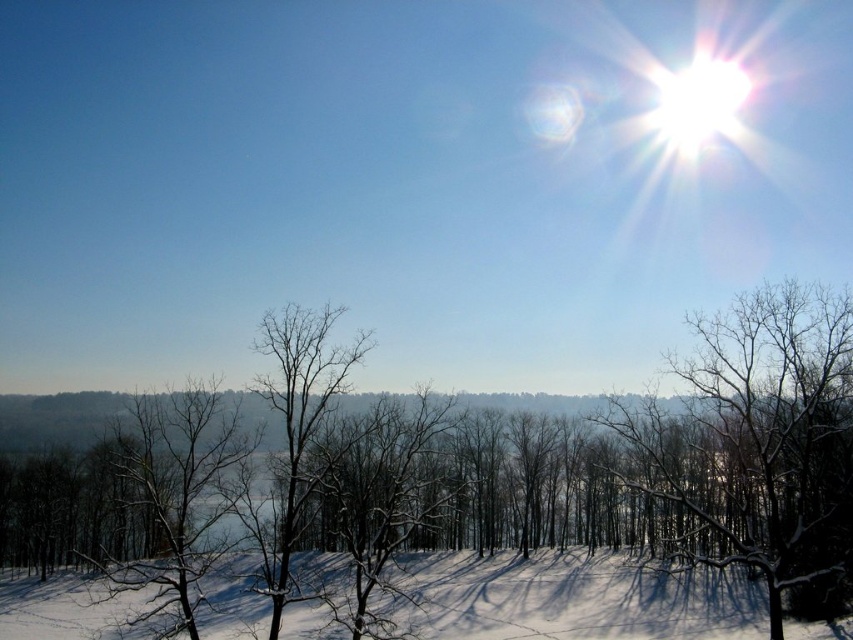
You are an outdoor photographer planning to take a photo of the snowy bare tree at center and the white snow at lower center. You want to ensure both elements are in focus. The camera you are using has a depth of field that can cover 10 feet. Will both elements be in focus in your photo?

The snowy bare tree at center and white snow at lower center are 10.70 feet apart. Since the depth of field can only cover 10 feet, the distance between them exceeds the camera setting. Therefore, both elements might not be in focus simultaneously.

You are standing at the center of the winter landscape and want to walk towards the snowy bare tree at center. Which direction should you head?

The snowy bare tree at center is located at point (453, 483), which is slightly to the right and forward from your current position. You should head towards the right and forward direction to reach it.